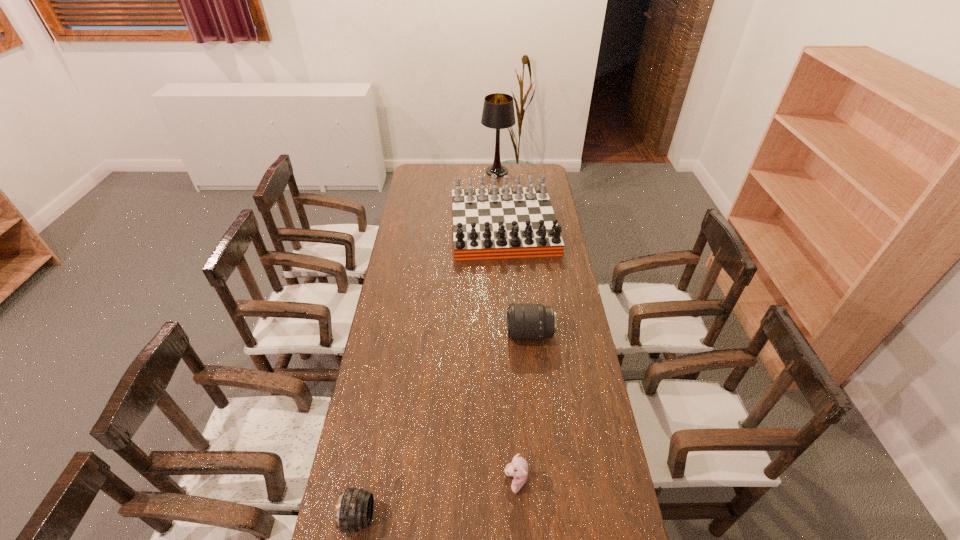
Locate an element on the screen. the tallest object is located at coordinates (498, 113).

The width and height of the screenshot is (960, 540). Find the location of `table lamp`. table lamp is located at coordinates (498, 113).

Locate an element on the screen. Image resolution: width=960 pixels, height=540 pixels. gameboard is located at coordinates (505, 222).

You are a GUI agent. You are given a task and a screenshot of the screen. Output one action in this format:
    pyautogui.click(x=<x>, y=<y>)
    Task: Click on the fourth nearest object
    The width and height of the screenshot is (960, 540).
    Given the screenshot: What is the action you would take?
    pyautogui.click(x=505, y=222)

The image size is (960, 540). Identify the location of the farther telephoto lens. (525, 322).

Locate an element on the screen. the third tallest object is located at coordinates (525, 322).

This screenshot has width=960, height=540. Identify the location of the fourth farthest object. (518, 468).

This screenshot has height=540, width=960. Find the location of `the leftmost object`. the leftmost object is located at coordinates (354, 510).

Identify the location of the nearest object. The image size is (960, 540). (354, 510).

The image size is (960, 540). I want to click on vacant space located 0.180m on the front of the farthest object, so click(498, 198).